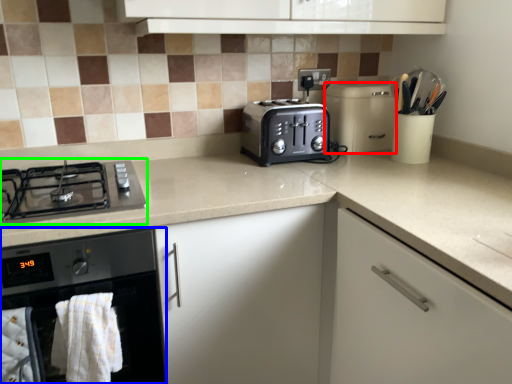
Question: Based on their relative distances, which object is farther from kitchen appliance (highlighted by a red box)? Choose from home appliance (highlighted by a blue box) and gas stove (highlighted by a green box).

Choices:
 (A) home appliance
 (B) gas stove

Answer: (A)